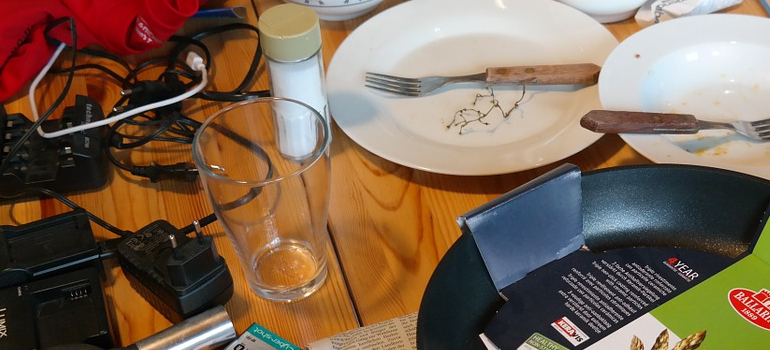
The image size is (770, 350). Identify the location of round plate. (684, 43), (517, 37).